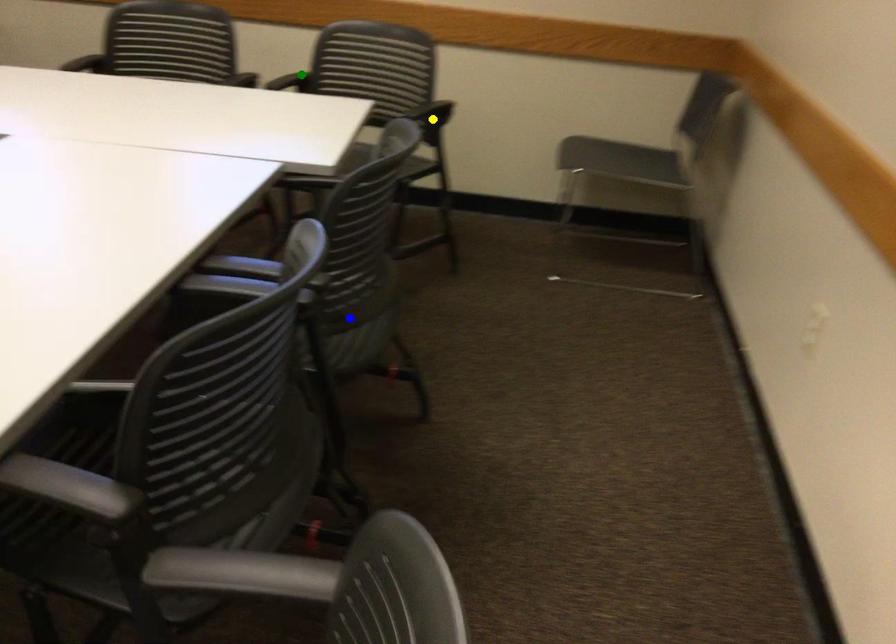
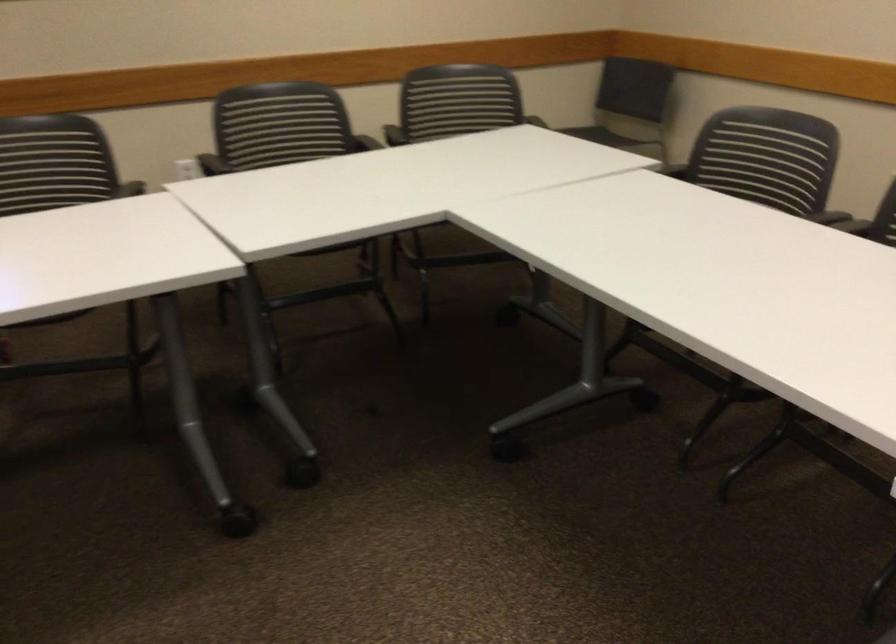
I am providing you with two images of the same scene from different viewpoints. Three points are marked in image1. Which point corresponds to a part or object that is occluded in image2?In image1, three points are marked. Which of them correspond to a part or object that is occluded in image2?Among the three points shown in image1, which one corresponds to a part or object that is no longer visible due to occlusion in image2?

yellow point, blue point, green point cannot be seen in image2.